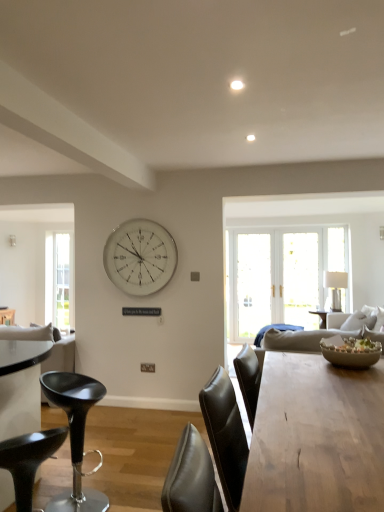
Question: From a real-world perspective, is clear glass window at left physically above wooden table at center?

Choices:
 (A) no
 (B) yes

Answer: (B)

Question: Is clear glass window at left positioned in front of wooden table at center?

Choices:
 (A) yes
 (B) no

Answer: (B)

Question: Can you confirm if clear glass window at left is positioned to the right of wooden table at center?

Choices:
 (A) no
 (B) yes

Answer: (A)

Question: Is clear glass window at left further to camera compared to wooden table at center?

Choices:
 (A) no
 (B) yes

Answer: (B)

Question: Considering the relative sizes of clear glass window at left and wooden table at center in the image provided, is clear glass window at left bigger than wooden table at center?

Choices:
 (A) yes
 (B) no

Answer: (B)

Question: In the image, is wooden table at center positioned in front of or behind black leather stool at lower left, the first chair from the back?

Choices:
 (A) behind
 (B) front

Answer: (B)

Question: Is wooden table at center bigger or smaller than black leather stool at lower left, the first chair from the back?

Choices:
 (A) big
 (B) small

Answer: (A)

Question: From a real-world perspective, is wooden table at center above or below black leather stool at lower left, which is the 2th chair in front-to-back order?

Choices:
 (A) above
 (B) below

Answer: (A)

Question: From the image's perspective, is wooden table at center positioned above or below black leather stool at lower left, the first chair from the back?

Choices:
 (A) above
 (B) below

Answer: (A)

Question: Is point (69, 408) closer or farther from the camera than point (43, 446)?

Choices:
 (A) closer
 (B) farther

Answer: (B)

Question: Is black leather stool at lower left, which is the 2th chair in front-to-back order, taller or shorter than black leather stool at lower left, the second chair in the back-to-front sequence?

Choices:
 (A) tall
 (B) short

Answer: (A)

Question: From a real-world perspective, is black leather stool at lower left, the first chair from the back, positioned above or below black leather stool at lower left, the second chair in the back-to-front sequence?

Choices:
 (A) above
 (B) below

Answer: (A)

Question: Would you say black leather stool at lower left, the first chair from the back, is inside or outside black leather stool at lower left, positioned as the first chair in front-to-back order?

Choices:
 (A) outside
 (B) inside

Answer: (A)

Question: Considering the positions of black leather stool at lower left, positioned as the first chair in front-to-back order, and white glossy lamp at right in the image, is black leather stool at lower left, positioned as the first chair in front-to-back order, taller or shorter than white glossy lamp at right?

Choices:
 (A) short
 (B) tall

Answer: (A)

Question: In the image, is black leather stool at lower left, the second chair in the back-to-front sequence, on the left side or the right side of white glossy lamp at right?

Choices:
 (A) right
 (B) left

Answer: (B)